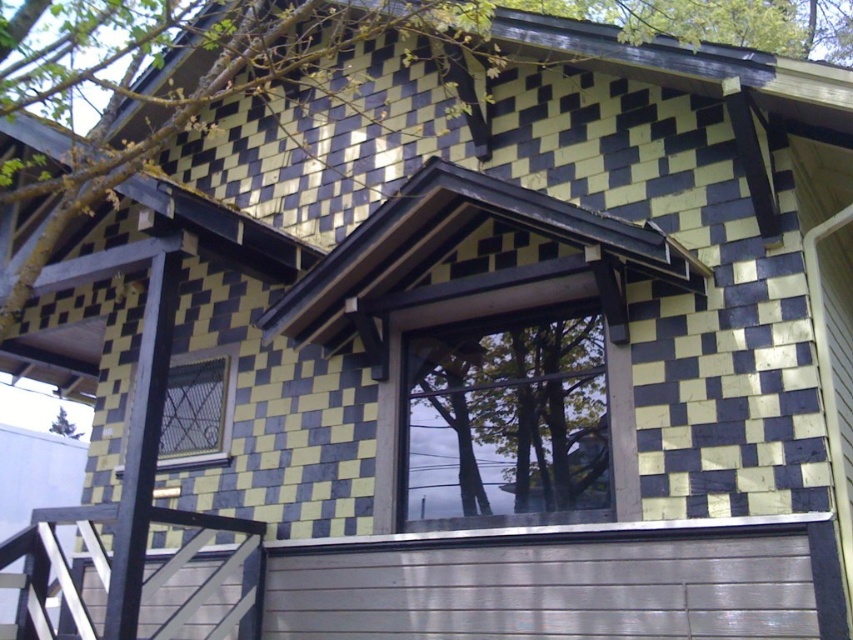
Question: Among these points, which one is farthest from the camera?

Choices:
 (A) (154, 609)
 (B) (85, 634)

Answer: (A)

Question: Among these points, which one is farthest from the camera?

Choices:
 (A) (45, 579)
 (B) (589, 561)
 (C) (187, 618)

Answer: (A)

Question: Among these points, which one is farthest from the camera?

Choices:
 (A) (86, 593)
 (B) (248, 612)

Answer: (A)

Question: Is wooden balustrade at lower left closer to camera compared to smooth gray stair at lower left?

Choices:
 (A) yes
 (B) no

Answer: (A)

Question: Is white painted wood garage door at lower center to the right of smooth gray stair at lower left from the viewer's perspective?

Choices:
 (A) no
 (B) yes

Answer: (B)

Question: Does wooden balustrade at lower left have a greater width compared to smooth gray stair at lower left?

Choices:
 (A) yes
 (B) no

Answer: (A)